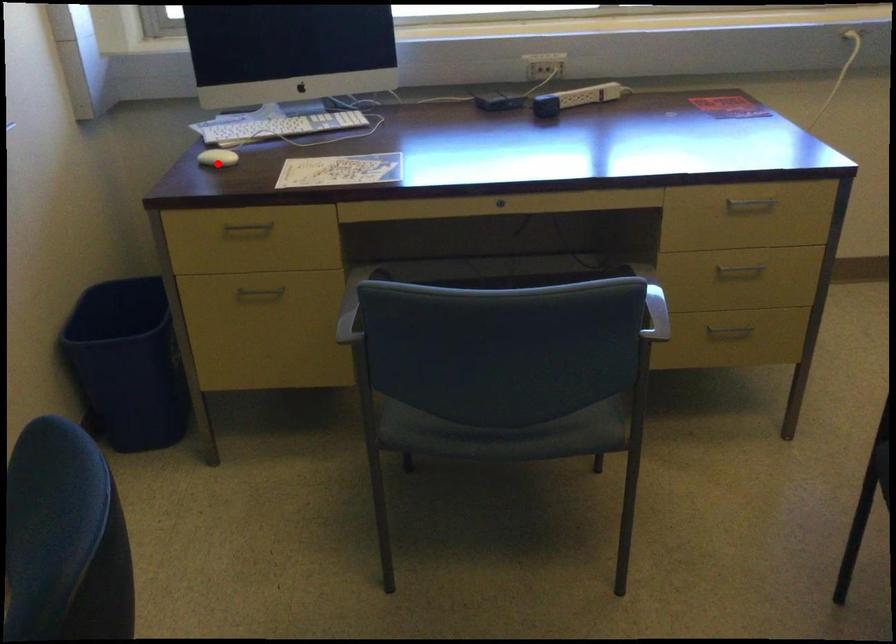
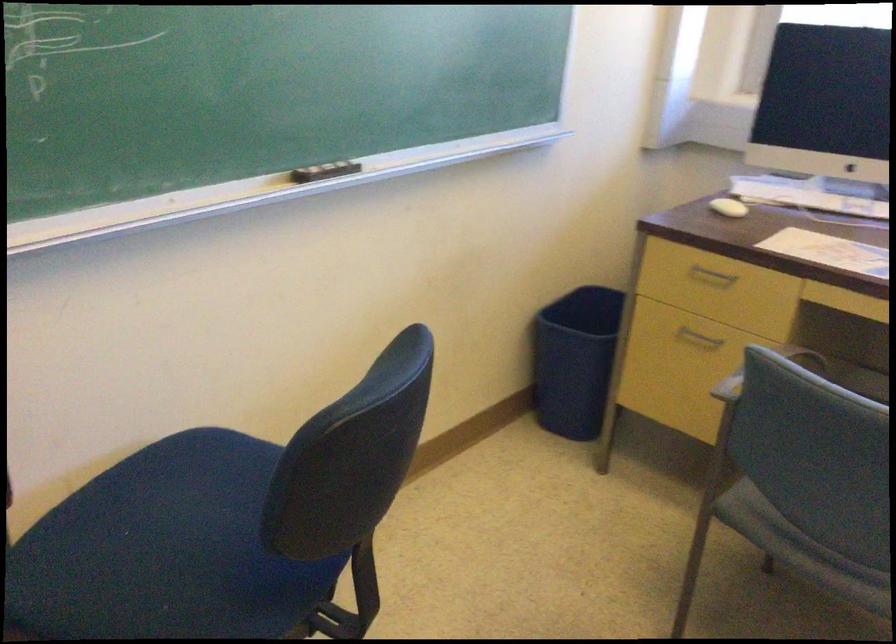
The point at the highlighted location is marked in the first image. Where is the corresponding point in the second image?

(728, 207)